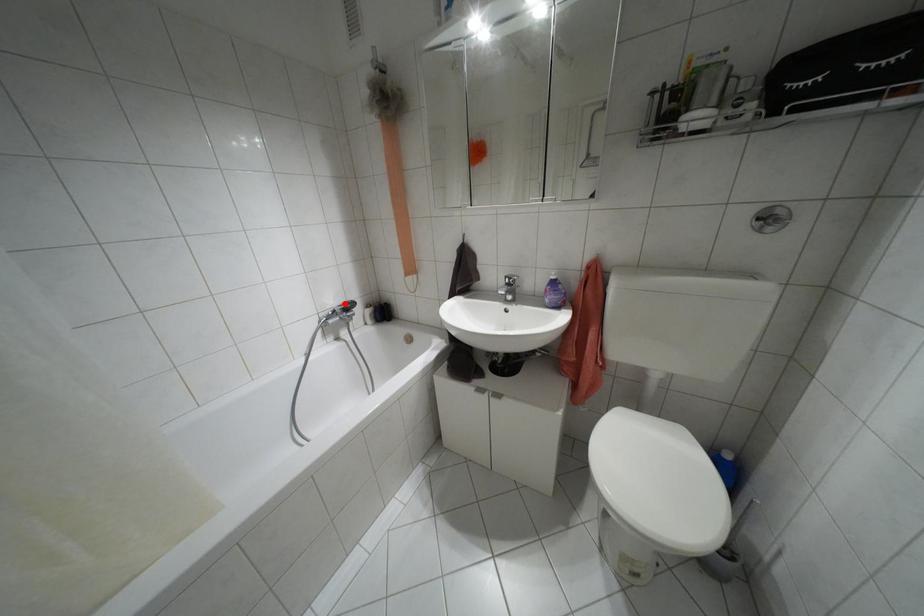
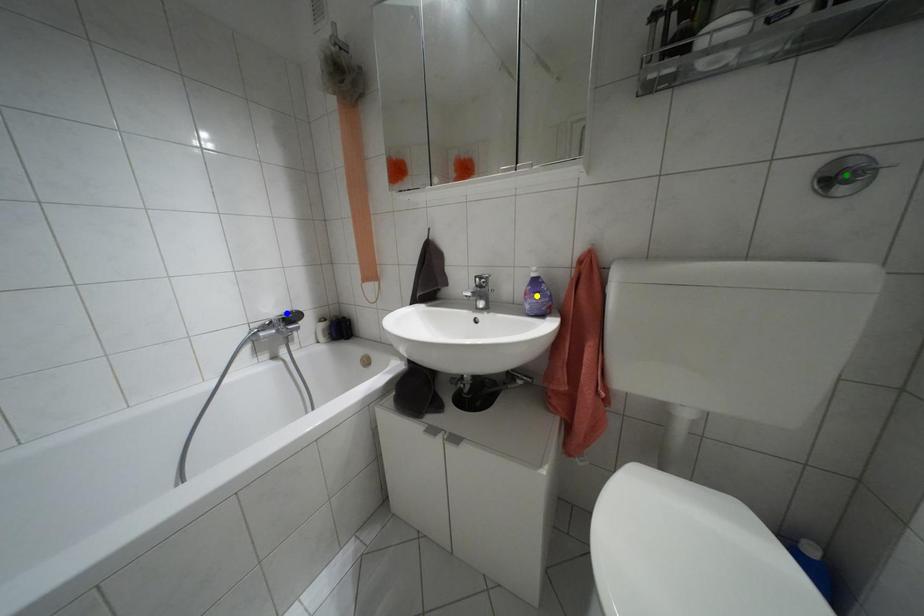
Question: I am providing you with two images of the same scene from different viewpoints. A red point is marked on the first image. You are given multiple points on the second image. Which spot in image 2 lines up with the point in image 1?

Choices:
 (A) yellow point
 (B) blue point
 (C) green point

Answer: (B)